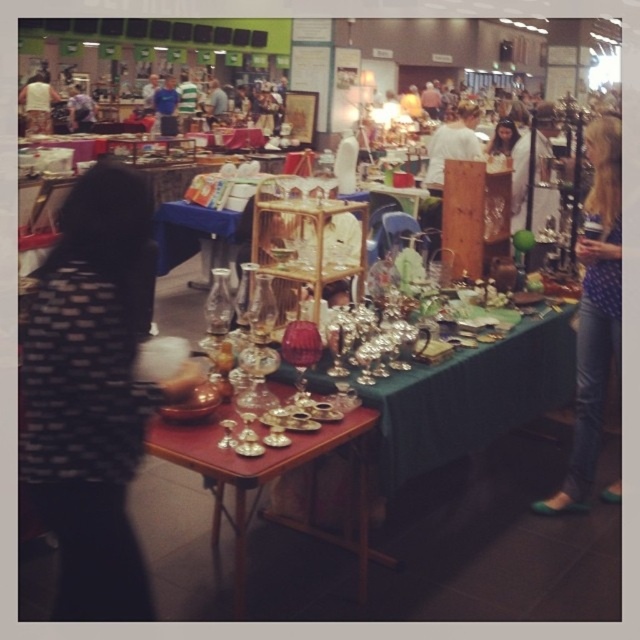
Question: Which object is farther from the camera taking this photo?

Choices:
 (A) matte black hair at center
 (B) blue denim jeans at lower right

Answer: (A)

Question: Can you confirm if black textured shirt at left is wider than shiny metallic tableware at center?

Choices:
 (A) yes
 (B) no

Answer: (B)

Question: Among these objects, which one is nearest to the camera?

Choices:
 (A) shiny metallic tableware at center
 (B) black textured shirt at left

Answer: (B)

Question: Is shiny metallic tableware at center to the left of blue denim jeans at lower right from the viewer's perspective?

Choices:
 (A) yes
 (B) no

Answer: (A)

Question: Is blue denim jeans at lower right thinner than matte black hair at center?

Choices:
 (A) no
 (B) yes

Answer: (A)

Question: Which object is positioned closest to the matte black hair at center?

Choices:
 (A) black textured shirt at left
 (B) shiny metallic tableware at center

Answer: (B)